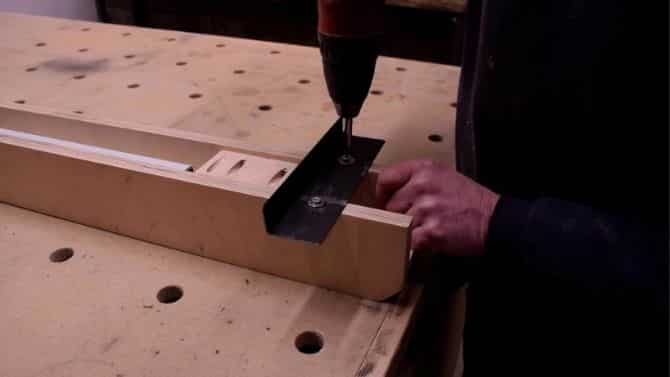
This screenshot has height=377, width=670. I want to click on wooden rod, so click(161, 162).